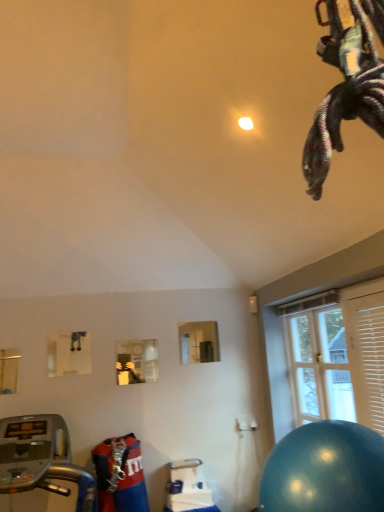
What do you see at coordinates (277, 373) in the screenshot? I see `clear glass door at right` at bounding box center [277, 373].

Locate an element on the screen. The width and height of the screenshot is (384, 512). wooden blinds at right is located at coordinates (366, 349).

From the image's perspective, relative to wooden blinds at right, is shiny blue ball at lower right above or below?

Based on their image positions, shiny blue ball at lower right is located beneath wooden blinds at right.

From a real-world perspective, is shiny blue ball at lower right positioned above or below wooden blinds at right?

shiny blue ball at lower right is situated lower than wooden blinds at right in the real world.

In the scene shown: Does shiny blue ball at lower right have a lesser height compared to wooden blinds at right?

Yes.

You are a GUI agent. You are given a task and a screenshot of the screen. Output one action in this format:
    pyautogui.click(x=<x>, y=<y>)
    Task: Click on the ball behind the silver metallic treadmill at lower left
    The image size is (384, 512).
    Given the screenshot: What is the action you would take?
    pyautogui.click(x=325, y=470)

Considering the relative positions of shiny blue ball at lower right and silver metallic treadmill at lower left in the image provided, is shiny blue ball at lower right in front of silver metallic treadmill at lower left?

No, the depth of shiny blue ball at lower right is greater than that of silver metallic treadmill at lower left.

From the image's perspective, is shiny blue ball at lower right located beneath silver metallic treadmill at lower left?

No.

Considering the relative sizes of shiny blue ball at lower right and silver metallic treadmill at lower left in the image provided, is shiny blue ball at lower right thinner than silver metallic treadmill at lower left?

Indeed, shiny blue ball at lower right has a lesser width compared to silver metallic treadmill at lower left.

Considering the sizes of wooden blinds at right and clear glass door at right in the image, is wooden blinds at right bigger or smaller than clear glass door at right?

In the image, wooden blinds at right appears to be smaller than clear glass door at right.

From a real-world perspective, which object rests below the other?

clear glass door at right, from a real-world perspective.

Looking at this image, measure the distance from wooden blinds at right to clear glass door at right.

wooden blinds at right is 1.01 meters away from clear glass door at right.

Which of these two, wooden blinds at right or clear glass door at right, is thinner?

With smaller width is wooden blinds at right.

Is silver metallic treadmill at lower left at the back of clear glass door at right?

No.

Between clear glass door at right and silver metallic treadmill at lower left, which one is positioned in front?

Positioned in front is silver metallic treadmill at lower left.

From the image's perspective, is clear glass door at right located above or below silver metallic treadmill at lower left?

clear glass door at right is situated higher than silver metallic treadmill at lower left in the image.

Is wooden blinds at right bigger or smaller than silver metallic treadmill at lower left?

Considering their sizes, wooden blinds at right takes up less space than silver metallic treadmill at lower left.

From the image's perspective, is wooden blinds at right above or below silver metallic treadmill at lower left?

From the image's perspective, wooden blinds at right appears above silver metallic treadmill at lower left.

In the scene shown: Is wooden blinds at right situated inside silver metallic treadmill at lower left or outside?

wooden blinds at right is outside silver metallic treadmill at lower left.

Considering the relative sizes of clear glass door at right and shiny blue ball at lower right in the image provided, is clear glass door at right shorter than shiny blue ball at lower right?

No, clear glass door at right is not shorter than shiny blue ball at lower right.

From a real-world perspective, is clear glass door at right physically above shiny blue ball at lower right?

Yes, from a real-world perspective, clear glass door at right is over shiny blue ball at lower right

Is clear glass door at right located outside shiny blue ball at lower right?

Yes, clear glass door at right is located beyond the bounds of shiny blue ball at lower right.

Would you consider clear glass door at right to be distant from shiny blue ball at lower right?

Yes, clear glass door at right and shiny blue ball at lower right are quite far apart.

From the image's perspective, is clear glass door at right located above or below wooden blinds at right?

Based on their image positions, clear glass door at right is located beneath wooden blinds at right.

Is clear glass door at right oriented towards wooden blinds at right?

No, clear glass door at right does not turn towards wooden blinds at right.

Which object is wider, clear glass door at right or wooden blinds at right?

clear glass door at right is wider.

Where is `shutter located above the shiny blue ball at lower right (from the image's perspective)`? This screenshot has width=384, height=512. shutter located above the shiny blue ball at lower right (from the image's perspective) is located at coordinates (366, 349).

This screenshot has width=384, height=512. Find the location of `ball located above the silver metallic treadmill at lower left (from a real-world perspective)`. ball located above the silver metallic treadmill at lower left (from a real-world perspective) is located at coordinates (325, 470).

Considering their positions, is shiny blue ball at lower right positioned closer to silver metallic treadmill at lower left than wooden blinds at right?

shiny blue ball at lower right is positioned closer to the anchor silver metallic treadmill at lower left.

From the image, which object appears to be nearer to wooden blinds at right, clear glass door at right or silver metallic treadmill at lower left?

clear glass door at right is positioned closer to the anchor wooden blinds at right.

When comparing their distances from clear glass door at right, does silver metallic treadmill at lower left or shiny blue ball at lower right seem further?

shiny blue ball at lower right is positioned further to the anchor clear glass door at right.

Estimate the real-world distances between objects in this image. Which object is further from clear glass door at right, shiny blue ball at lower right or wooden blinds at right?

Among the two, shiny blue ball at lower right is located further to clear glass door at right.

From the image, which object appears to be farther from wooden blinds at right, silver metallic treadmill at lower left or shiny blue ball at lower right?

silver metallic treadmill at lower left lies further to wooden blinds at right than the other object.

Based on their spatial positions, is wooden blinds at right or silver metallic treadmill at lower left further from clear glass door at right?

silver metallic treadmill at lower left is positioned further to the anchor clear glass door at right.

Based on their spatial positions, is wooden blinds at right or clear glass door at right closer to silver metallic treadmill at lower left?

The object closer to silver metallic treadmill at lower left is clear glass door at right.

Considering their positions, is silver metallic treadmill at lower left positioned closer to clear glass door at right than wooden blinds at right?

wooden blinds at right.

Where is `shutter between shiny blue ball at lower right and clear glass door at right from front to back`? Image resolution: width=384 pixels, height=512 pixels. shutter between shiny blue ball at lower right and clear glass door at right from front to back is located at coordinates (366, 349).

You are a GUI agent. You are given a task and a screenshot of the screen. Output one action in this format:
    pyautogui.click(x=<x>, y=<y>)
    Task: Click on the ball between silver metallic treadmill at lower left and clear glass door at right
    The width and height of the screenshot is (384, 512).
    Given the screenshot: What is the action you would take?
    pyautogui.click(x=325, y=470)

Where is `window located between silver metallic treadmill at lower left and wooden blinds at right in the left-right direction`? The width and height of the screenshot is (384, 512). window located between silver metallic treadmill at lower left and wooden blinds at right in the left-right direction is located at coordinates (277, 373).

Find the location of a particular element. ball between silver metallic treadmill at lower left and wooden blinds at right from left to right is located at coordinates (325, 470).